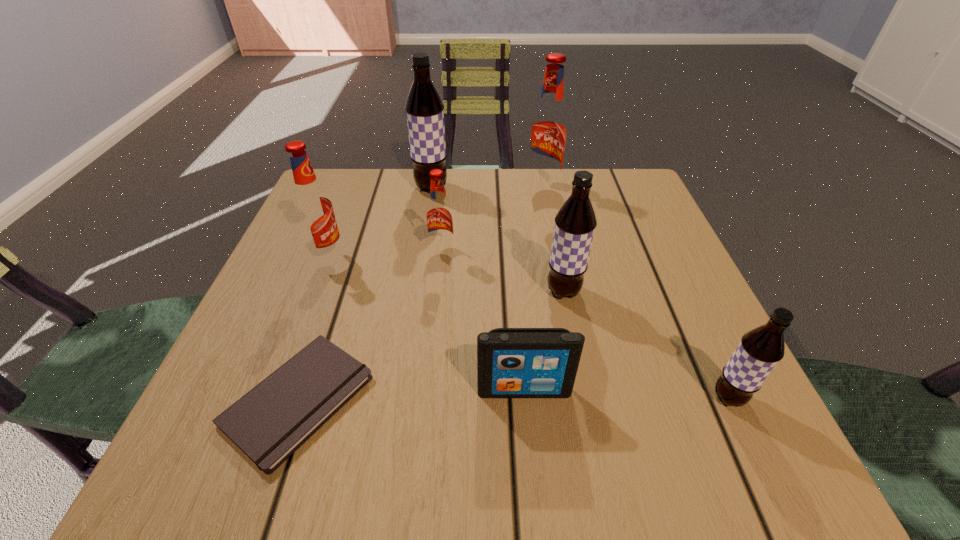
The image size is (960, 540). Find the location of `blank area in the image that satisfies the following two spatial constraints: 1. on the back side of the leftmost red root beer; 2. on the left side of the smallest red root beer`. blank area in the image that satisfies the following two spatial constraints: 1. on the back side of the leftmost red root beer; 2. on the left side of the smallest red root beer is located at coordinates (330, 251).

You are a GUI agent. You are given a task and a screenshot of the screen. Output one action in this format:
    pyautogui.click(x=<x>, y=<y>)
    Task: Click on the vacant space that satisfies the following two spatial constraints: 1. on the back side of the biggest brown root beer; 2. on the left side of the leftmost red root beer
    
    Given the screenshot: What is the action you would take?
    354,187

Locate an element on the screen. vacant space that satisfies the following two spatial constraints: 1. on the front side of the second nearest root beer; 2. on the left side of the second smallest red root beer is located at coordinates (314, 291).